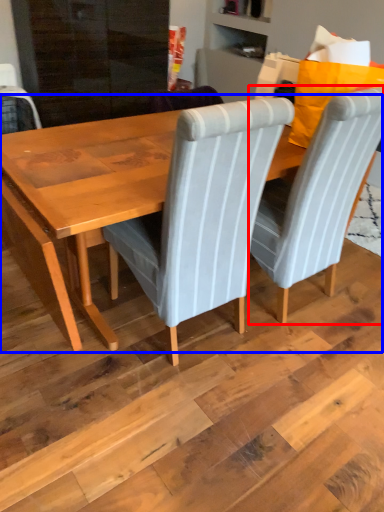
Question: Which object is closer to the camera taking this photo, chair (highlighted by a red box) or table (highlighted by a blue box)?

Choices:
 (A) chair
 (B) table

Answer: (B)